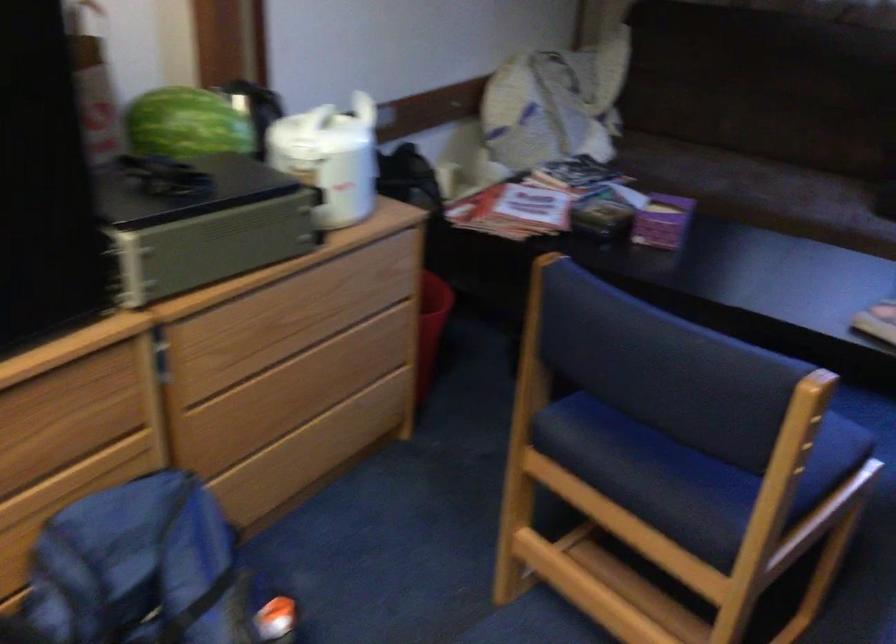
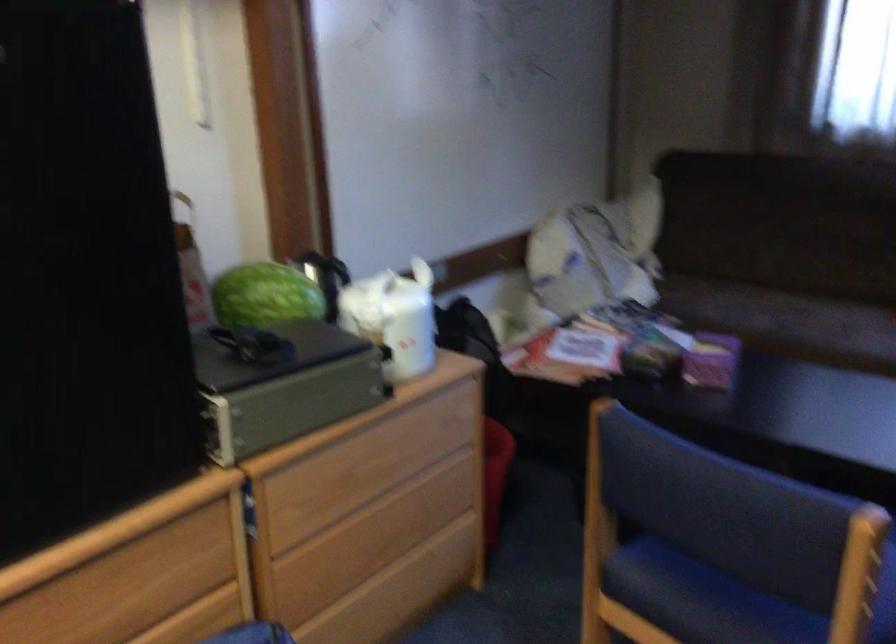
In the second image, find the point that corresponds to [185,122] in the first image.

(264, 295)